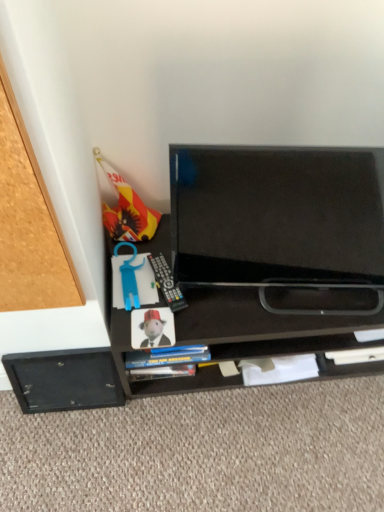
Locate an element on the screen. This screenshot has width=384, height=512. unoccupied region to the right of black plastic remote at lower center is located at coordinates (226, 308).